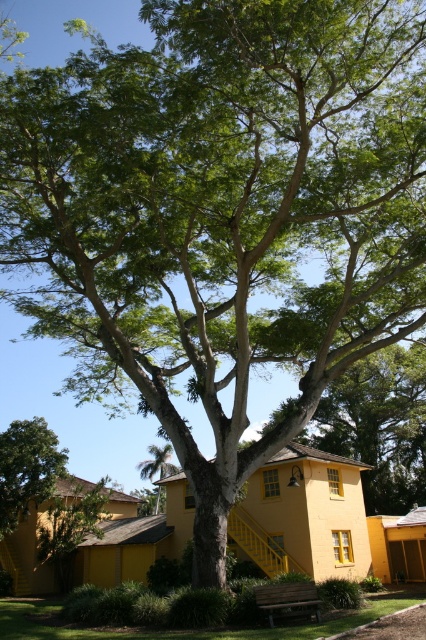
Question: Which point appears farthest from the camera in this image?

Choices:
 (A) (396, 592)
 (B) (14, 522)

Answer: (B)

Question: Does green grass at lower center have a larger size compared to green leafy tree at lower left?

Choices:
 (A) no
 (B) yes

Answer: (B)

Question: Does green grass at lower center appear over green leafy tree at lower left?

Choices:
 (A) yes
 (B) no

Answer: (B)

Question: Which of the following is the closest to the observer?

Choices:
 (A) (66, 460)
 (B) (111, 628)

Answer: (B)

Question: Does green grass at lower center appear on the right side of green leafy tree at lower left?

Choices:
 (A) no
 (B) yes

Answer: (B)